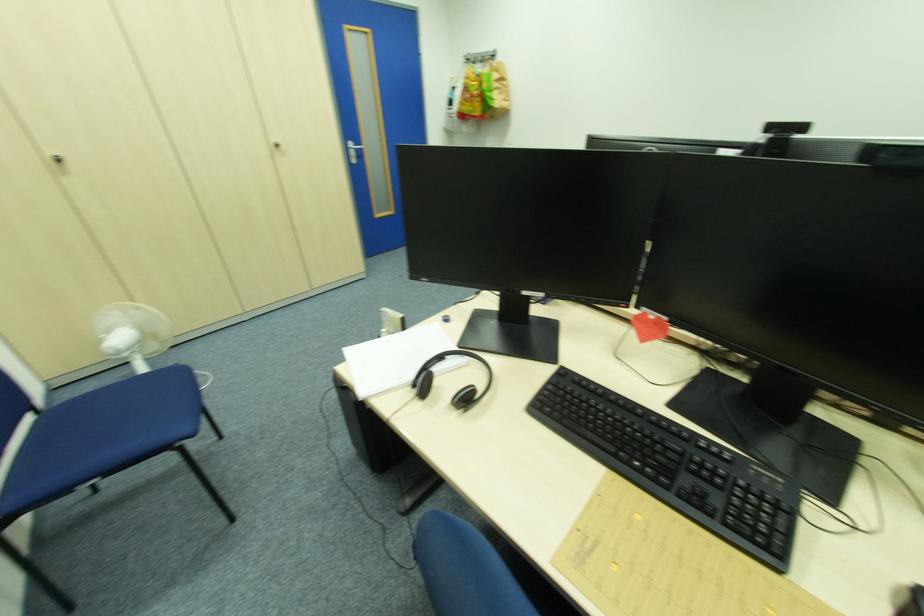
Which object does [451,379] point to?

This point indicates the black headphones.